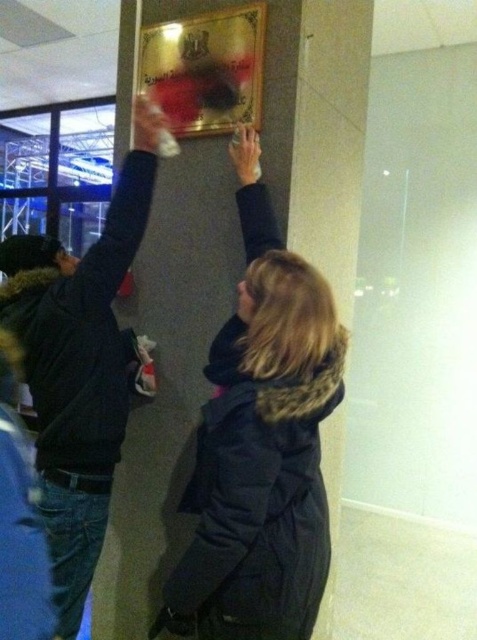
Question: Does black fur-lined coat at upper center lie behind black fuzzy jacket at upper left?

Choices:
 (A) no
 (B) yes

Answer: (A)

Question: Is black fur-lined coat at upper center positioned at the back of black fuzzy jacket at upper left?

Choices:
 (A) yes
 (B) no

Answer: (B)

Question: Which object is closer to the camera taking this photo?

Choices:
 (A) black fur-lined coat at upper center
 (B) black fuzzy jacket at upper left

Answer: (A)

Question: Which point is farther to the camera?

Choices:
 (A) (123, 208)
 (B) (251, 131)

Answer: (B)

Question: Where is black fur-lined coat at upper center located in relation to black fuzzy jacket at upper left in the image?

Choices:
 (A) above
 (B) below

Answer: (B)